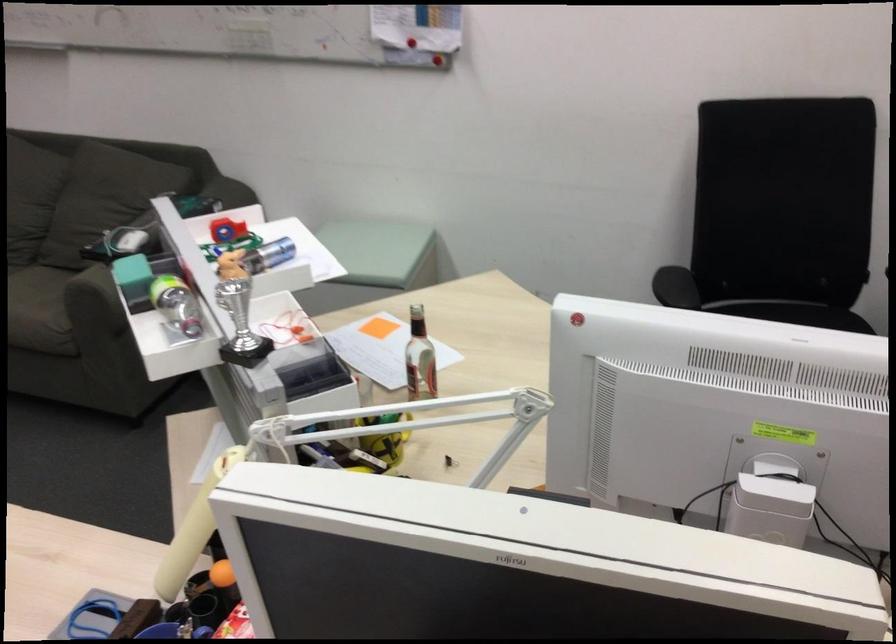
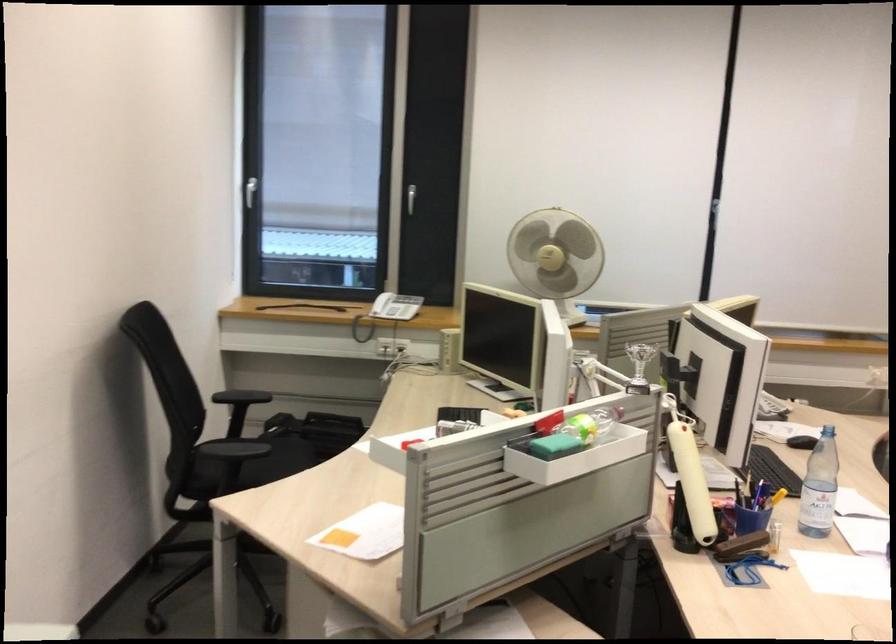
Question: I am providing you with two images of the same scene from different viewpoints. Please identify which objects are invisible in image2.

Choices:
 (A) small silver trophy
 (B) white desk fan
 (C) yellow pen holder
 (D) black plastic part

Answer: (C)